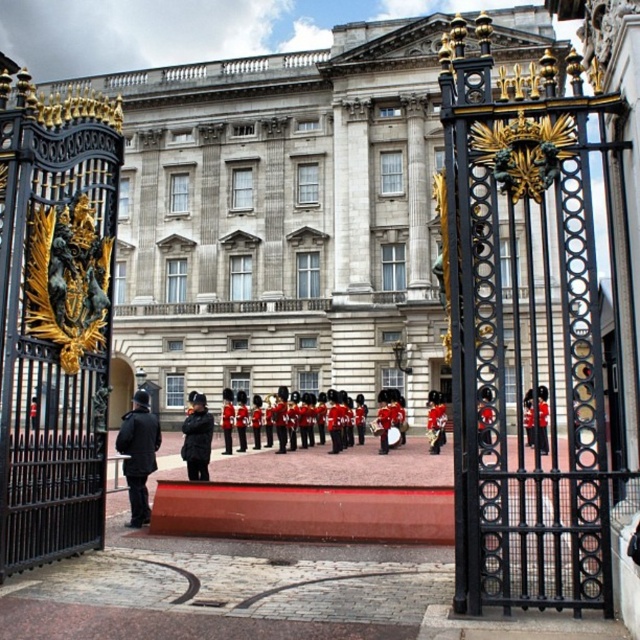
Does black matte jacket at center have a larger size compared to shiny red uniform at center?

Indeed, black matte jacket at center has a larger size compared to shiny red uniform at center.

Locate an element on the screen. The image size is (640, 640). black matte jacket at center is located at coordinates (196, 438).

Between point (198, 467) and point (346, 412), which one is positioned in front?

Point (198, 467) is in front.

In order to click on black matte jacket at center in this screenshot , I will do `click(196, 438)`.

Measure the distance between white stone building at center and shiny red uniform at center.

white stone building at center and shiny red uniform at center are 20.76 meters apart.

Can you confirm if white stone building at center is positioned to the left of shiny red uniform at center?

Correct, you'll find white stone building at center to the left of shiny red uniform at center.

The width and height of the screenshot is (640, 640). In order to click on white stone building at center in this screenshot , I will do `click(280, 220)`.

At what (x,y) coordinates should I click in order to perform the action: click on white stone building at center. Please return your answer as a coordinate pair (x, y). Image resolution: width=640 pixels, height=640 pixels. Looking at the image, I should click on (x=280, y=220).

Can you confirm if shiny red uniform at center is smaller than red velvet uniform at center?

Incorrect, shiny red uniform at center is not smaller in size than red velvet uniform at center.

Who is positioned more to the left, shiny red uniform at center or red velvet uniform at center?

shiny red uniform at center

Identify the location of shiny red uniform at center. The height and width of the screenshot is (640, 640). (394, 417).